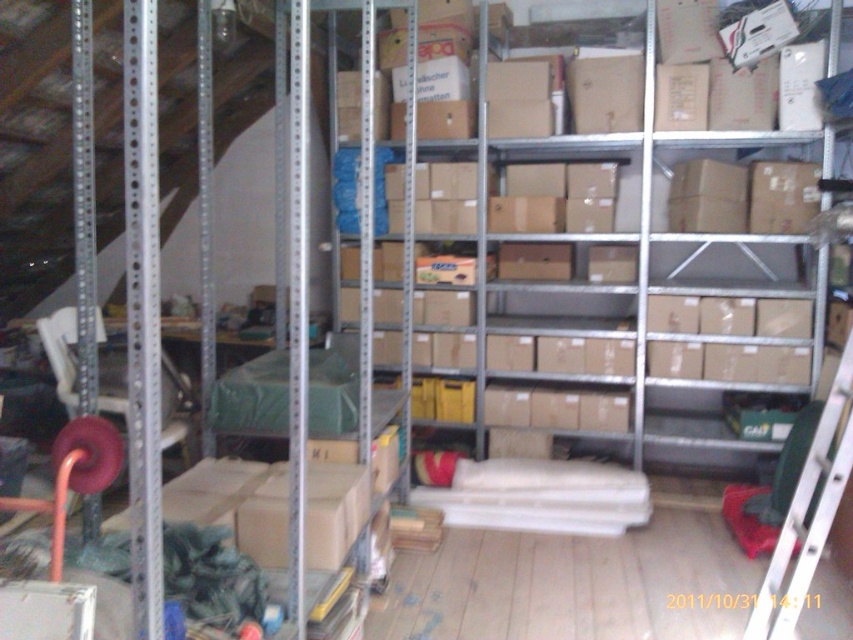
You are standing in the storage area and want to place a new box at the point marked by coordinates point (602, 288). Is this point located on any of the objects present in the scene?

Yes, the point (602, 288) is on the brown cardboard boxes at center, so placing the new box there would be appropriate.

You are a delivery person who needs to place a new box that is 1.5 meters long in the storage area. The new box must be placed between the brown cardboard boxes at center and the silver metallic ladder at lower right. Is there enough space between them to fit the new box?

The brown cardboard boxes at center and the silver metallic ladder at lower right are 1.53 meters apart. Since the new box is 1.5 meters long, there is enough space between them to fit the new box as the distance is slightly larger than the box length.